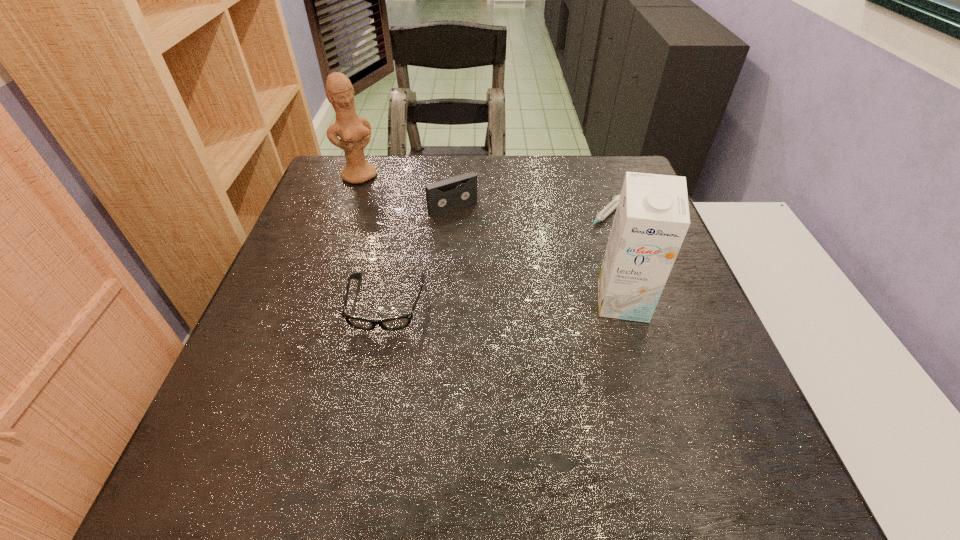
I want to click on vacant space situated 0.070m at the needle end of the syringe, so click(x=580, y=243).

The width and height of the screenshot is (960, 540). In order to click on vacant area situated 0.210m on the front-facing side of the third shortest object in this screenshot , I will do `click(506, 265)`.

Image resolution: width=960 pixels, height=540 pixels. Identify the location of vacant space located on the front-facing side of the third shortest object. (524, 287).

I want to click on vacant space situated 0.390m on the front-facing side of the third shortest object, so click(x=551, y=319).

Locate an element on the screen. vacant space situated 0.070m on the front-facing side of the leftmost object is located at coordinates (379, 197).

Find the location of a particular element. vacant area located on the front-facing side of the leftmost object is located at coordinates (417, 238).

At what (x,y) coordinates should I click in order to perform the action: click on vacant space located on the front-facing side of the leftmost object. Please return your answer as a coordinate pair (x, y). Looking at the image, I should click on (396, 215).

The width and height of the screenshot is (960, 540). I want to click on syringe positioned at the far edge, so click(x=613, y=204).

Identify the location of videotape that is positioned at the far edge. The image size is (960, 540). (442, 196).

At what (x,y) coordinates should I click in order to perform the action: click on figurine that is at the far edge. Please return your answer as a coordinate pair (x, y). The height and width of the screenshot is (540, 960). Looking at the image, I should click on (355, 132).